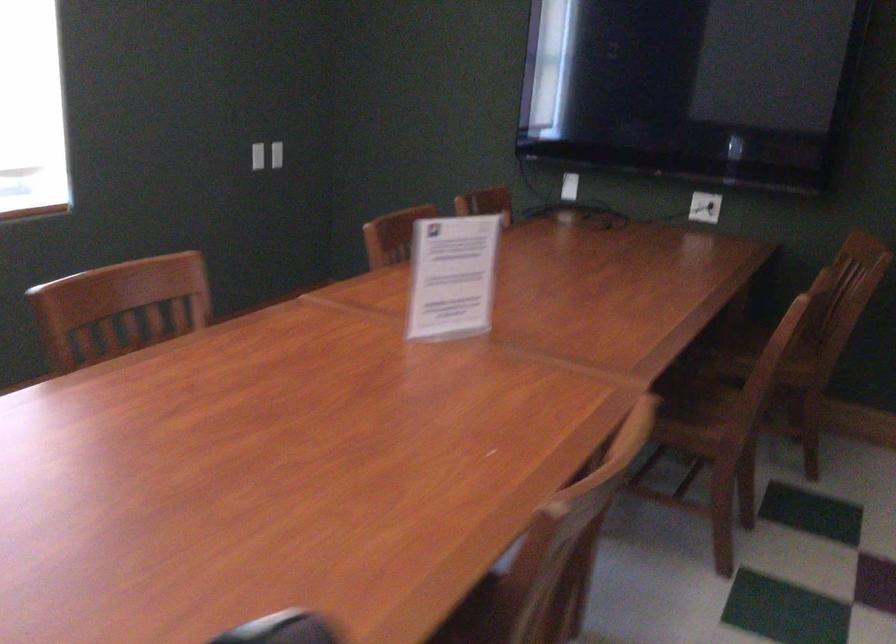
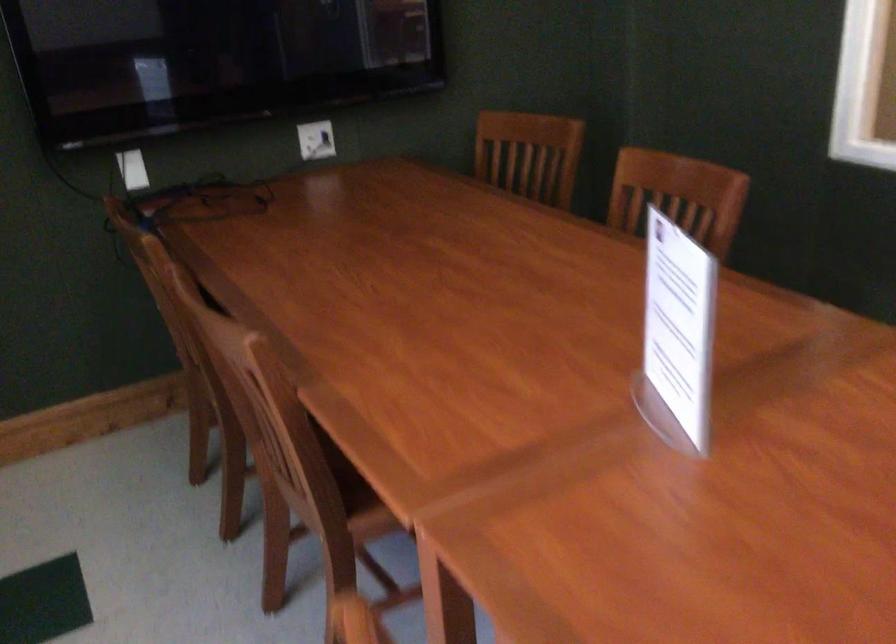
Find the pixel in the second image that matches the point at 446,285 in the first image.

(677, 335)